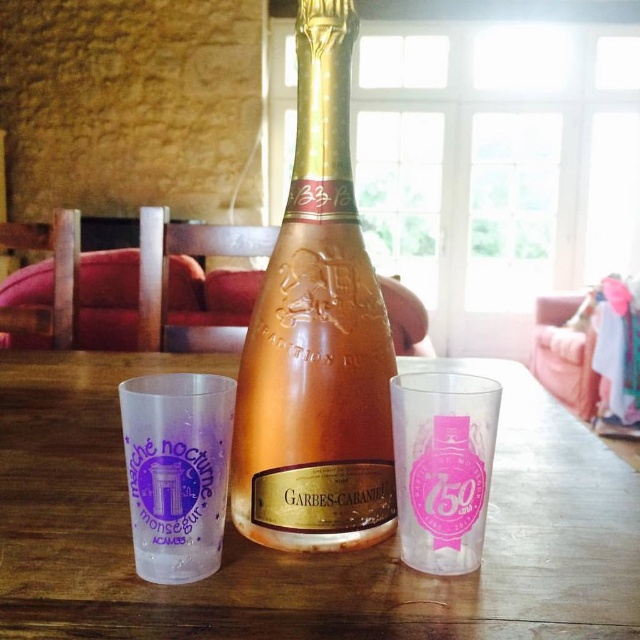
Question: Among these points, which one is nearest to the camera?

Choices:
 (A) (195, 518)
 (B) (259, 346)
 (C) (484, 449)
 (D) (93, 436)

Answer: (A)

Question: Is transparent plastic cup at lower left below transparent plastic cup at center?

Choices:
 (A) yes
 (B) no

Answer: (A)

Question: Estimate the real-world distances between objects in this image. Which object is closer to the pink glass bottle at center?

Choices:
 (A) transparent plastic cup at center
 (B) transparent plastic cup at lower left

Answer: (B)

Question: Can you confirm if transparent plastic cup at lower left is wider than transparent plastic cup at center?

Choices:
 (A) no
 (B) yes

Answer: (B)

Question: Does pink glass bottle at center have a larger size compared to transparent plastic cup at center?

Choices:
 (A) no
 (B) yes

Answer: (B)

Question: Among these objects, which one is farthest from the camera?

Choices:
 (A) pink glass bottle at center
 (B) transparent plastic cup at center
 (C) wooden table at center

Answer: (A)